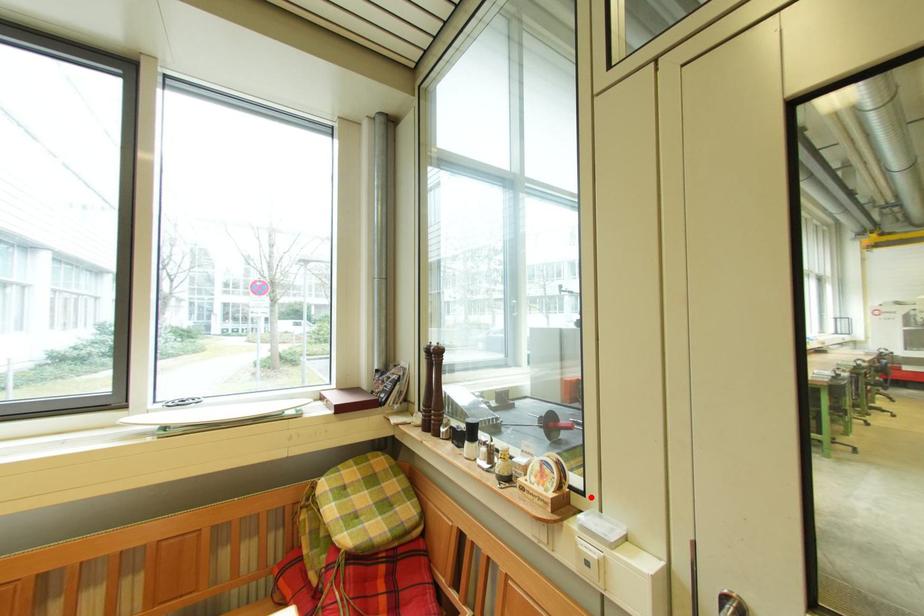
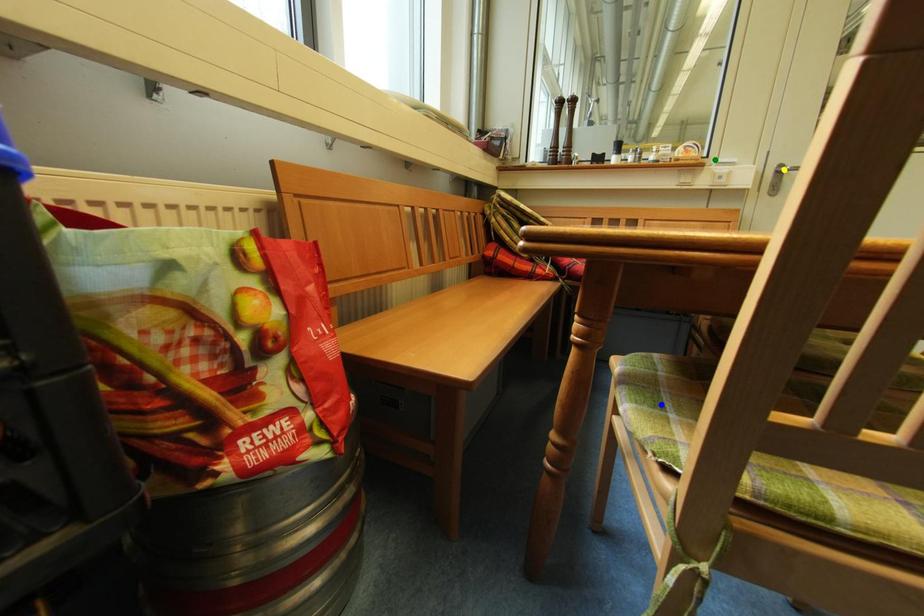
Question: I am providing you with two images of the same scene from different viewpoints. A red point is marked on the first image. You are given multiple points on the second image. Which point in image 2 represents the same 3d spot as the red point in image 1?

Choices:
 (A) yellow point
 (B) blue point
 (C) green point

Answer: (C)